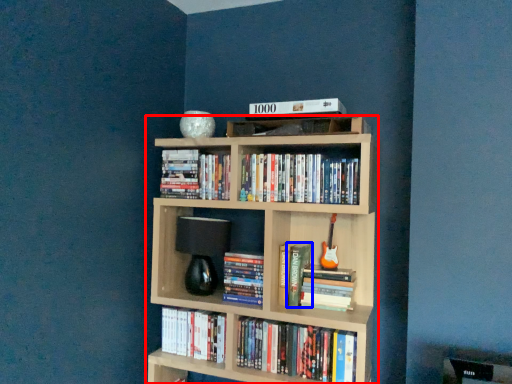
Question: Which of the following is the farthest to the observer, bookcase (highlighted by a red box) or book (highlighted by a blue box)?

Choices:
 (A) bookcase
 (B) book

Answer: (B)